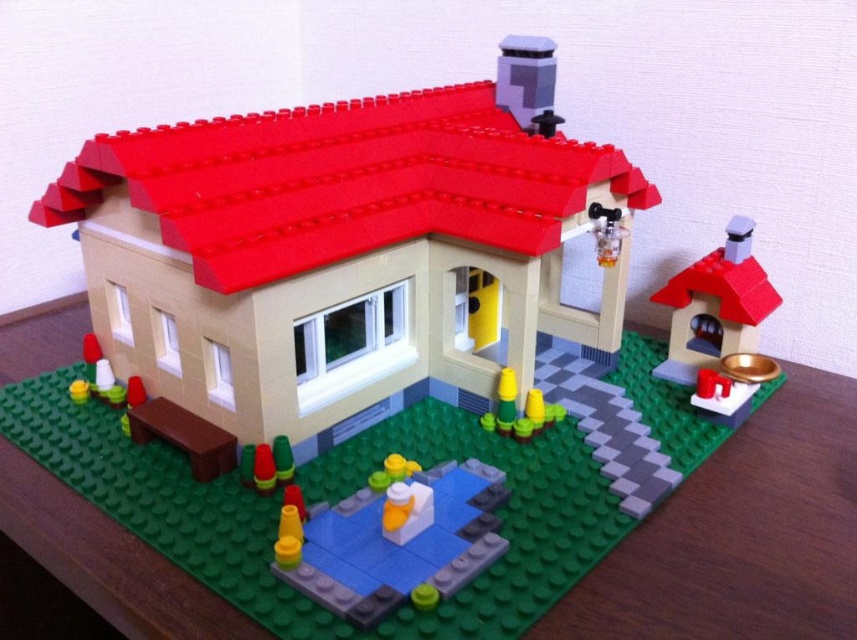
Can you confirm if smooth plastic duck at center is bigger than shiny gold bowl at right?

Actually, smooth plastic duck at center might be smaller than shiny gold bowl at right.

Is smooth plastic duck at center wider than shiny gold bowl at right?

Yes.

Is point (346, 566) closer to viewer compared to point (686, 332)?

That is True.

Image resolution: width=857 pixels, height=640 pixels. What are the coordinates of `smooth plastic duck at center` in the screenshot? It's located at (400, 541).